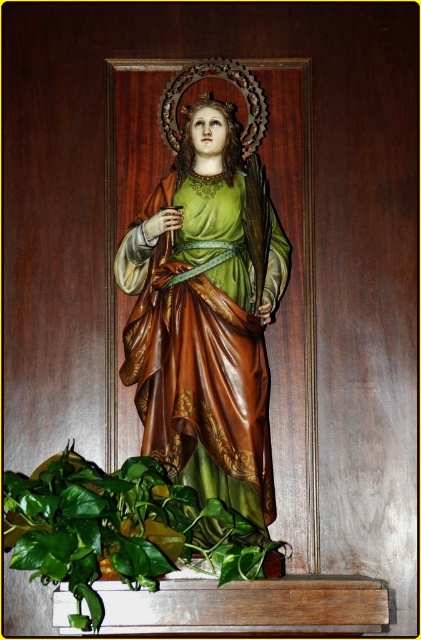
You are an interior designer planning to place a new lamp next to the green leafy plant at lower left. To ensure it doesn not block the view of the matte gold statue at center, where should you position the lamp relative to the plant?

Since the matte gold statue at center is much taller than the green leafy plant at lower left, the lamp should be placed behind the green leafy plant at lower left to avoid blocking the view of the statue.

You are an interior designer arranging a gallery space. You have a matte gold statue at center and a green leafy plant at lower left. According to the scene, which object is placed higher in the composition?

The matte gold statue at center is positioned over the green leafy plant at lower left, so it is higher in the composition.